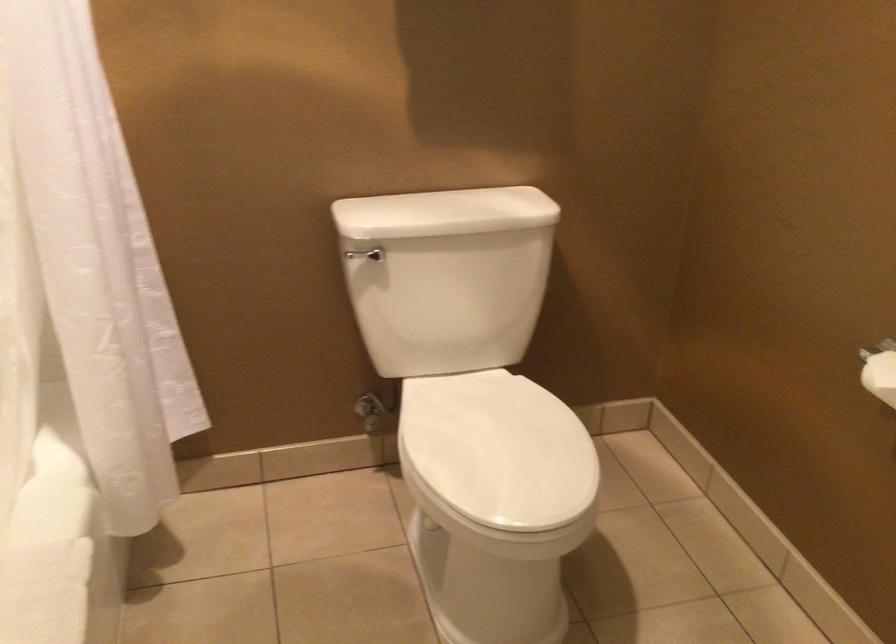
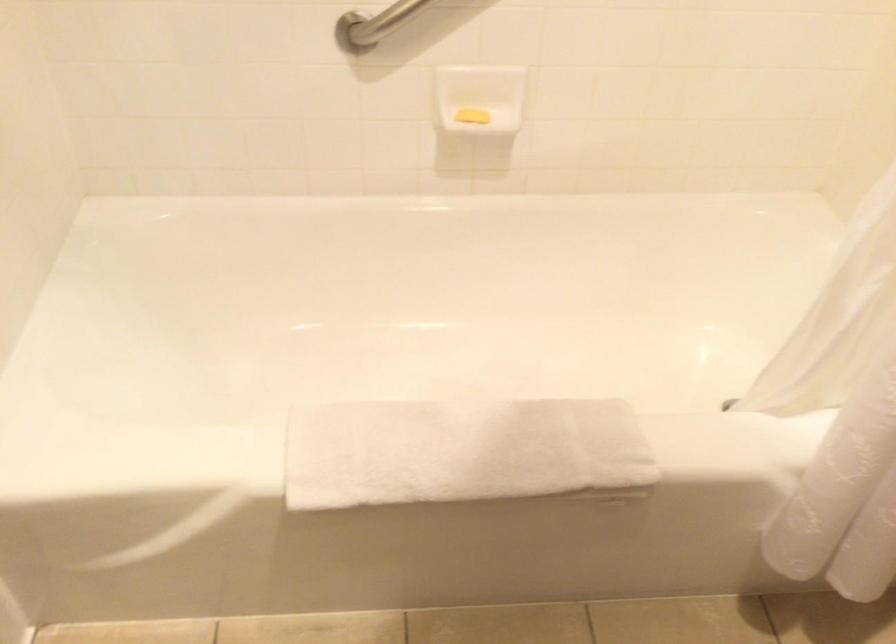
The first image is from the beginning of the video and the second image is from the end. How did the camera likely rotate when shooting the video?

The rotation direction of the camera is left-down.